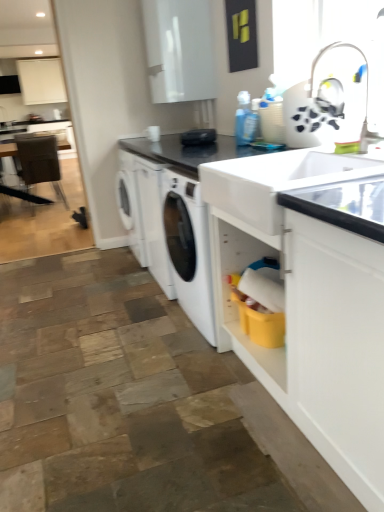
Question: Is white plastic faucet at upper right in front of or behind white glossy cabinet at upper center, which appears as the 2th cabinetry when viewed from the top, in the image?

Choices:
 (A) front
 (B) behind

Answer: (A)

Question: From the image's perspective, is white plastic faucet at upper right above or below white glossy cabinet at upper center, the 1th cabinetry positioned from the front?

Choices:
 (A) above
 (B) below

Answer: (B)

Question: Estimate the real-world distances between objects in this image. Which object is farther from the black granite countertop at center, arranged as the first countertop when viewed from the top?

Choices:
 (A) white glossy cabinet at upper center, which appears as the 2th cabinetry when viewed from the top
 (B) white plastic faucet at upper right
 (C) white matte cabinet at upper left, the 2th cabinetry in the front-to-back sequence
 (D) brown leather chair at left
 (E) white glossy sink at center

Answer: (C)

Question: Considering the real-world distances, which object is farthest from the brown leather chair at left?

Choices:
 (A) white plastic faucet at upper right
 (B) white glossy cabinet at upper center, the 1th cabinetry positioned from the front
 (C) white glossy sink at center
 (D) black matte sink at lower right, the 2th countertop from the top
 (E) black granite countertop at center, acting as the second countertop starting from the bottom

Answer: (D)